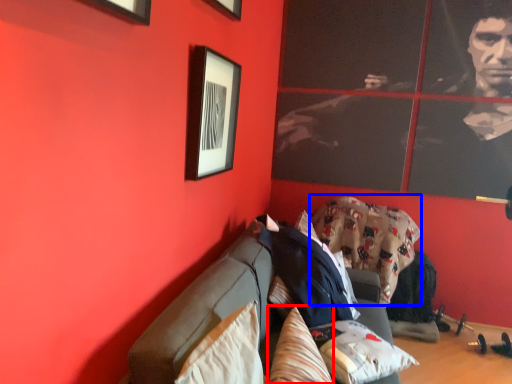
Question: Which object is closer to the camera taking this photo, pillow (highlighted by a red box) or blanket (highlighted by a blue box)?

Choices:
 (A) pillow
 (B) blanket

Answer: (A)